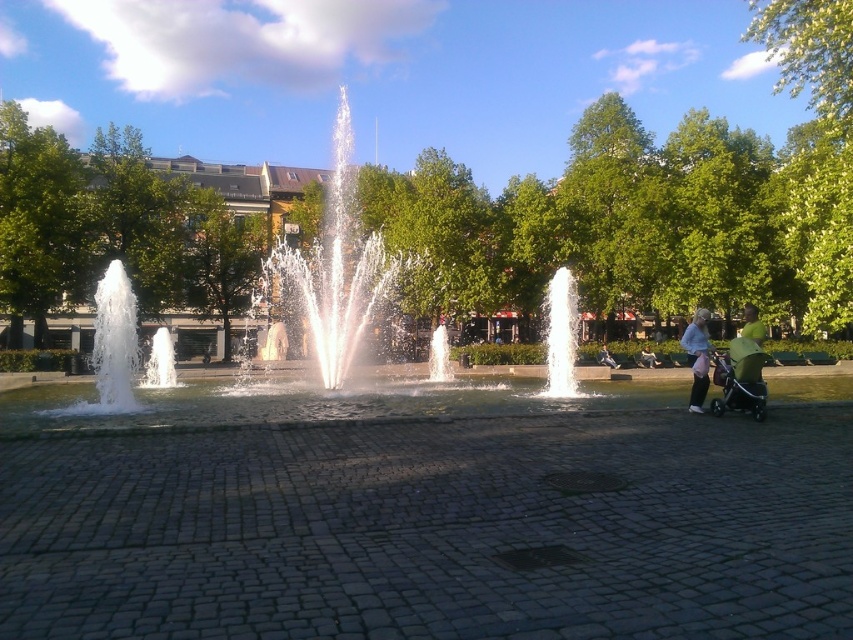
You are standing in the urban park and see the white water at center and the clear glass water at center. Which one is positioned more to the left?

The white water at center is positioned more to the left than the clear glass water at center.

You are a photographer wanting to capture the fountain in the park. You notice two types of water in the fountain, the white water at center and the clear glass water at center. Which one appears bigger in the scene?

The white water at center has a larger size compared to clear glass water at center, so the white water at center appears bigger in the scene.